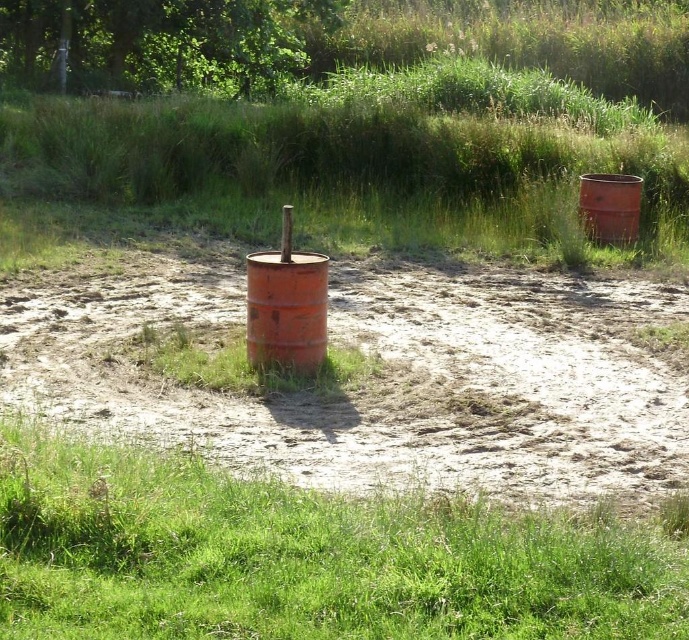
Can you confirm if dull orange barrel at center is shorter than rusty metal barrel at right?

Yes, dull orange barrel at center is shorter than rusty metal barrel at right.

Which of these two, dull orange barrel at center or rusty metal barrel at right, stands shorter?

Standing shorter between the two is dull orange barrel at center.

Which is behind, point (637, 458) or point (606, 221)?

The point (606, 221) is behind.

The image size is (689, 640). Find the location of `dull orange barrel at center`. dull orange barrel at center is located at coordinates (380, 378).

Looking at this image, between dull orange barrel at center and green grass at lower center, which one is positioned lower?

green grass at lower center is below.

Between dull orange barrel at center and green grass at lower center, which one has less height?

dull orange barrel at center

This screenshot has height=640, width=689. I want to click on dull orange barrel at center, so click(x=380, y=378).

Does dull orange barrel at center appear on the right side of rusty metal barrel at center?

Correct, you'll find dull orange barrel at center to the right of rusty metal barrel at center.

In order to click on dull orange barrel at center in this screenshot , I will do `click(380, 378)`.

The width and height of the screenshot is (689, 640). What do you see at coordinates (380, 378) in the screenshot? I see `dull orange barrel at center` at bounding box center [380, 378].

At what (x,y) coordinates should I click in order to perform the action: click on dull orange barrel at center. Please return your answer as a coordinate pair (x, y). This screenshot has width=689, height=640. Looking at the image, I should click on [x=380, y=378].